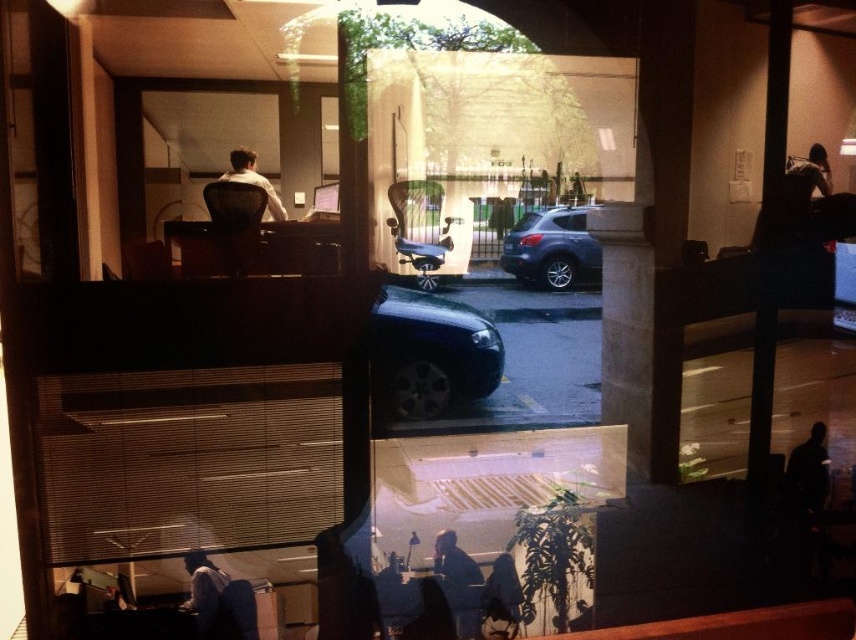
You are a delivery person standing outside the building looking through the glass window. You see the satin silver suv at center and the dark gray shirt at lower left. Which object is closer to you through the window?

The dark gray shirt at lower left is behind the satin silver suv at center, so the satin silver suv at center is closer to you through the window.

From the picture: You are standing inside the office space and looking through the large glass windows. You see the glossy black car at center and the silhouette figure at lower right. Which object is closer to the window?

The glossy black car at center is closer to the window because it is positioned over the silhouette figure at lower right, indicating it is in front of the figure and thus nearer to the observer.

You are standing in the indoor office area and want to see the outdoor parking lot through the glass windows. However, there are two items blocking your view slightly. Which item is closer to you, the dark blue jacket at lower center or the matte white shirt at upper center?

The dark blue jacket at lower center is closer to you because the matte white shirt at upper center is behind it.